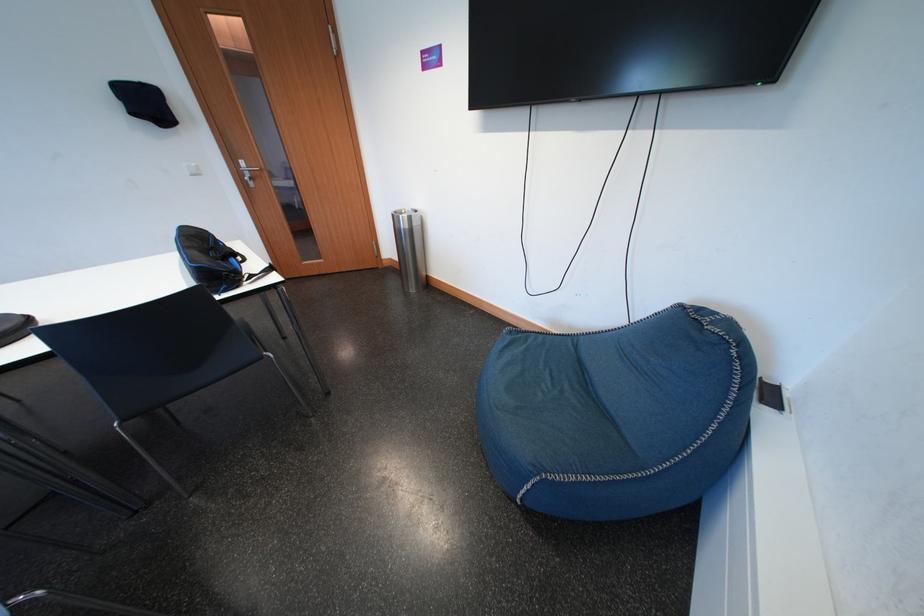
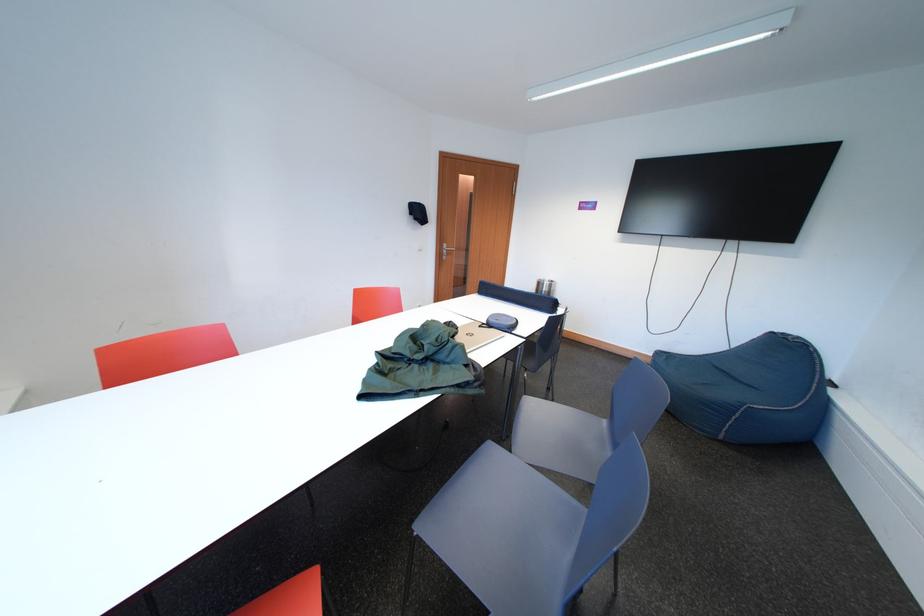
In the second image, find the point that corresponds to [251,167] in the first image.

(455, 249)